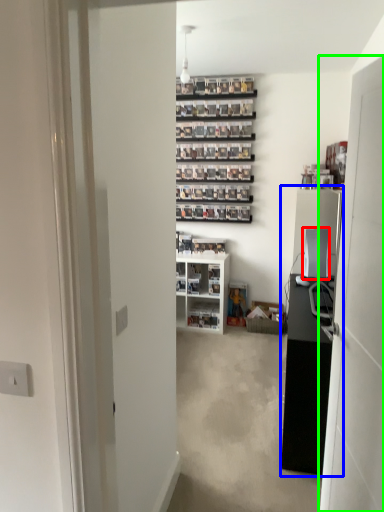
Question: Which object is the farthest from appliance (highlighted by a red box)? Choose among these: entertainment center (highlighted by a blue box) or door (highlighted by a green box).

Choices:
 (A) entertainment center
 (B) door

Answer: (B)